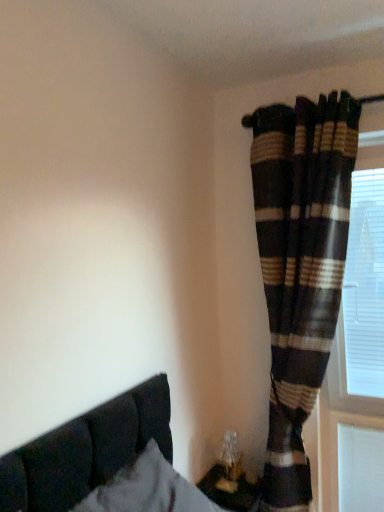
Question: Are plaid fabric curtain at right and white plastic blinds at right far apart?

Choices:
 (A) no
 (B) yes

Answer: (A)

Question: Is plaid fabric curtain at right positioned with its back to white plastic blinds at right?

Choices:
 (A) yes
 (B) no

Answer: (A)

Question: Considering the relative sizes of plaid fabric curtain at right and white plastic blinds at right in the image provided, is plaid fabric curtain at right wider than white plastic blinds at right?

Choices:
 (A) yes
 (B) no

Answer: (A)

Question: Can you confirm if plaid fabric curtain at right is bigger than white plastic blinds at right?

Choices:
 (A) no
 (B) yes

Answer: (B)

Question: Is the depth of plaid fabric curtain at right greater than that of white plastic blinds at right?

Choices:
 (A) no
 (B) yes

Answer: (A)

Question: In the image, is white plastic blinds at right positioned in front of or behind plaid fabric curtain at right?

Choices:
 (A) front
 (B) behind

Answer: (B)

Question: Is white plastic blinds at right wider or thinner than plaid fabric curtain at right?

Choices:
 (A) wide
 (B) thin

Answer: (B)

Question: Is point (352, 219) closer or farther from the camera than point (334, 135)?

Choices:
 (A) closer
 (B) farther

Answer: (B)

Question: From the image's perspective, is white plastic blinds at right located above or below plaid fabric curtain at right?

Choices:
 (A) below
 (B) above

Answer: (B)

Question: Is suede-like dark brown bed at lower left wider or thinner than plaid fabric curtain at right?

Choices:
 (A) thin
 (B) wide

Answer: (B)

Question: In terms of height, does suede-like dark brown bed at lower left look taller or shorter compared to plaid fabric curtain at right?

Choices:
 (A) tall
 (B) short

Answer: (B)

Question: From a real-world perspective, is suede-like dark brown bed at lower left physically located above or below plaid fabric curtain at right?

Choices:
 (A) above
 (B) below

Answer: (B)

Question: From the image's perspective, relative to plaid fabric curtain at right, is suede-like dark brown bed at lower left above or below?

Choices:
 (A) above
 (B) below

Answer: (B)

Question: In the image, is white plastic blinds at right positioned in front of or behind suede-like dark brown bed at lower left?

Choices:
 (A) front
 (B) behind

Answer: (B)

Question: From their relative heights in the image, would you say white plastic blinds at right is taller or shorter than suede-like dark brown bed at lower left?

Choices:
 (A) short
 (B) tall

Answer: (B)